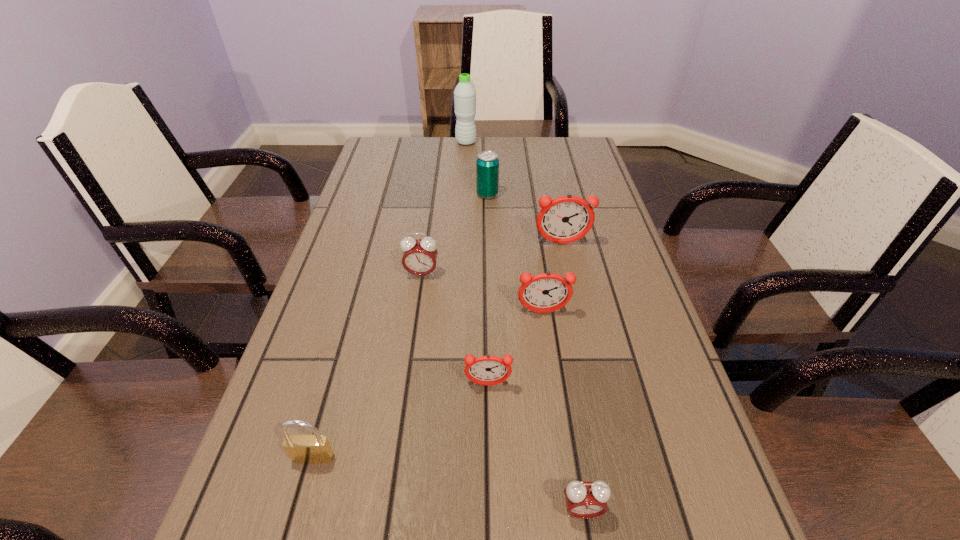
I want to click on vacant space located 0.190m on the front-facing side of the third farthest alarm clock, so click(555, 394).

Find the location of a particular element. The image size is (960, 540). vacant space located on the front-facing side of the padlock is located at coordinates (293, 531).

You are a GUI agent. You are given a task and a screenshot of the screen. Output one action in this format:
    pyautogui.click(x=<x>, y=<y>)
    Task: Click on the vacant space located on the front-facing side of the leftmost reddish-pink alarm clock
    This screenshot has height=540, width=960.
    Given the screenshot: What is the action you would take?
    pyautogui.click(x=490, y=509)

The width and height of the screenshot is (960, 540). Identify the location of object at the far edge. (464, 94).

Find the location of a particular element. object that is at the left edge is located at coordinates (308, 449).

This screenshot has height=540, width=960. Identify the location of object that is at the right edge. click(x=566, y=219).

You are a GUI agent. You are given a task and a screenshot of the screen. Output one action in this format:
    pyautogui.click(x=<x>, y=<y>)
    Task: Click on the vacant space at the far edge of the desktop
    This screenshot has height=540, width=960.
    Given the screenshot: What is the action you would take?
    pyautogui.click(x=446, y=157)

Image resolution: width=960 pixels, height=540 pixels. In the image, there is a desktop. Find the location of `vacant space at the left edge`. vacant space at the left edge is located at coordinates [401, 179].

This screenshot has width=960, height=540. Identify the location of vacant space at the right edge. (584, 176).

Identify the location of free space at the far right corner. (581, 146).